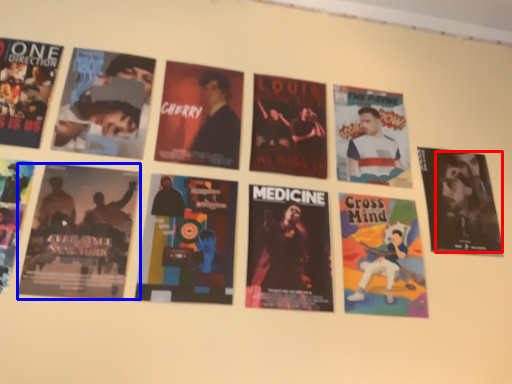
Question: Which object appears closest to the camera in this image, person (highlighted by a red box) or poster (highlighted by a blue box)?

Choices:
 (A) person
 (B) poster

Answer: (B)